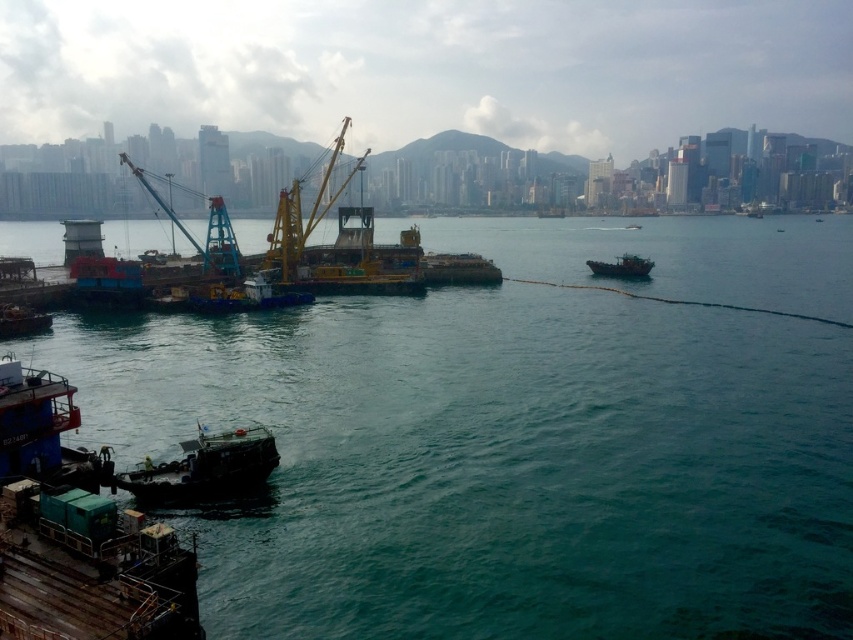
Is teal water at center in front of dark gray metallic boat at lower left?

That is True.

Between point (780, 624) and point (149, 497), which one is positioned behind?

Positioned behind is point (149, 497).

Is point (445, 584) farther from camera compared to point (231, 451)?

No, it is in front of (231, 451).

The height and width of the screenshot is (640, 853). In order to click on teal water at center in this screenshot , I will do `click(498, 461)`.

Is dark gray metallic boat at lower left smaller than rusty metal boat at center right?

Correct, dark gray metallic boat at lower left occupies less space than rusty metal boat at center right.

Which is more to the left, dark gray metallic boat at lower left or rusty metal boat at center right?

Answer: From the viewer's perspective, dark gray metallic boat at lower left appears more on the left side.

Is point (151, 499) positioned behind point (590, 269)?

That is False.

This screenshot has height=640, width=853. I want to click on dark gray metallic boat at lower left, so click(x=204, y=468).

In the scene shown: Who is more distant from viewer, (113, 445) or (637, 268)?

Positioned behind is point (637, 268).

Who is higher up, teal water at center or rusty metal boat at center right?

Positioned higher is teal water at center.

Is point (407, 451) in front of point (639, 272)?

Yes, point (407, 451) is closer to viewer.

Find the location of a particular element. teal water at center is located at coordinates (498, 461).